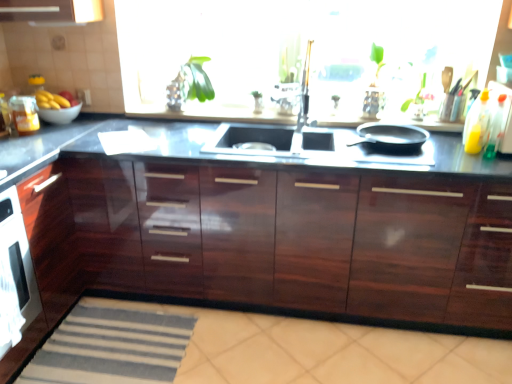
Where is `vacant region in front of translucent plastic bottle at right, positioned as the second bottle in front-to-back order`? This screenshot has width=512, height=384. vacant region in front of translucent plastic bottle at right, positioned as the second bottle in front-to-back order is located at coordinates (481, 161).